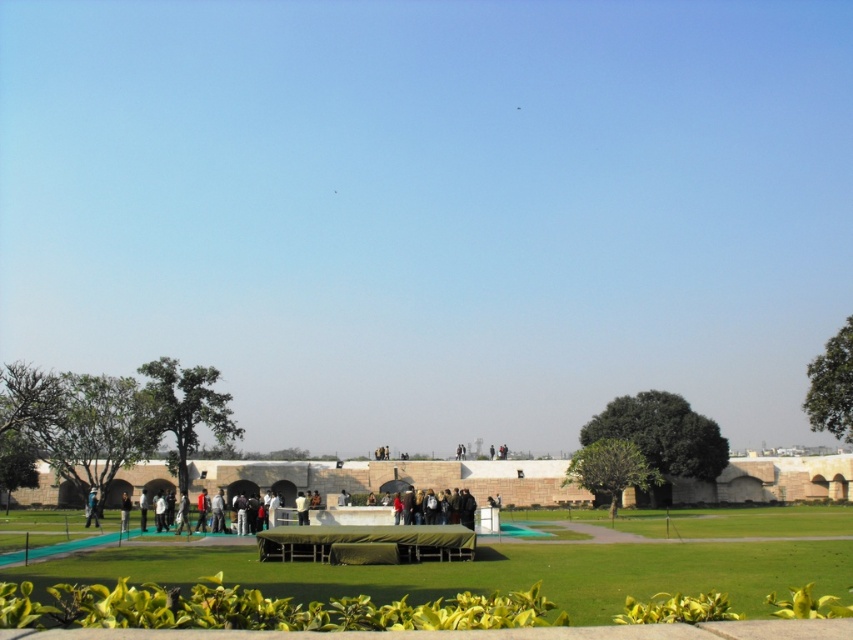
In the scene shown: You are a photographer trying to capture a photo of the dark gray jacket at center without the white fabric at center blocking it. How should you adjust your position?

Move forward to get closer to the dark gray jacket at center so that it moves out from behind the white fabric at center.

You are organizing a picnic and have two picnic blankets, a dark gray fabric at center and a white fabric at center. You want to place them side by side along the paved pathway. Which fabric should you place on the left to follow the existing arrangement?

The dark gray fabric at center is positioned on the right side of white fabric at center, so to follow the existing arrangement, place the white fabric at center on the left and the dark gray fabric at center on the right.